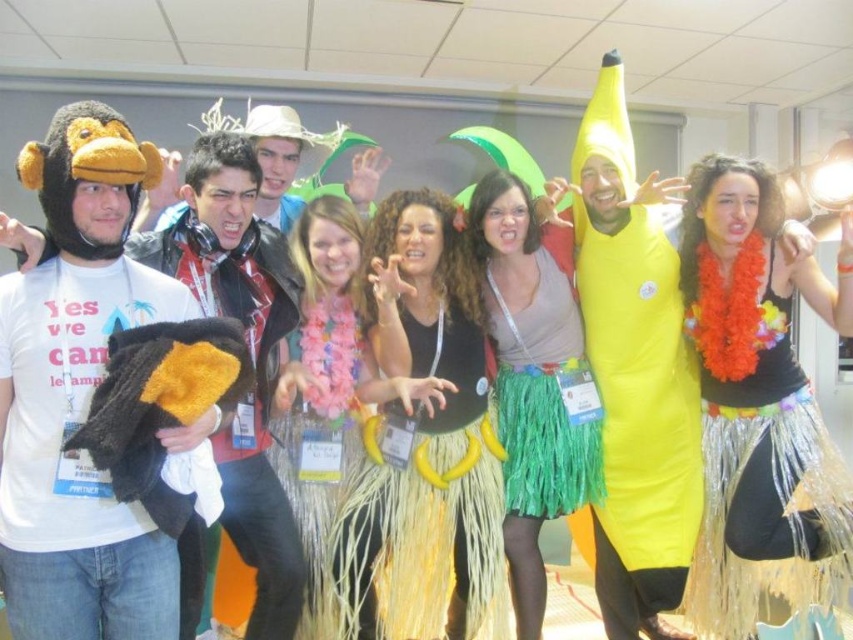
Is point (213, 282) behind point (537, 445)?

No, (213, 282) is closer to viewer.

Does fluffy black and yellow bird at center appear on the left side of green grass skirt at center?

Yes, fluffy black and yellow bird at center is to the left of green grass skirt at center.

Is point (268, 308) positioned after point (556, 404)?

That is False.

The image size is (853, 640). I want to click on fluffy black and yellow bird at center, so click(247, 403).

From the picture: Which of these two, fuzzy black and yellow monkey at left or shiny metallic skirt at center, stands shorter?

With less height is fuzzy black and yellow monkey at left.

Which is behind, point (85, 596) or point (775, 460)?

Positioned behind is point (775, 460).

Who is more forward, (113, 268) or (770, 432)?

Point (113, 268) is more forward.

In order to click on fuzzy black and yellow monkey at left in this screenshot , I will do `click(74, 458)`.

Which is behind, point (651, 196) or point (453, 516)?

The point (453, 516) is behind.

Can you confirm if yellow inflatable banana at center is positioned to the left of yellow grass skirt at center?

No, yellow inflatable banana at center is not to the left of yellow grass skirt at center.

Describe the element at coordinates (634, 372) in the screenshot. I see `yellow inflatable banana at center` at that location.

You are a GUI agent. You are given a task and a screenshot of the screen. Output one action in this format:
    pyautogui.click(x=<x>, y=<y>)
    Task: Click on the yellow inflatable banana at center
    The width and height of the screenshot is (853, 640).
    Given the screenshot: What is the action you would take?
    pyautogui.click(x=634, y=372)